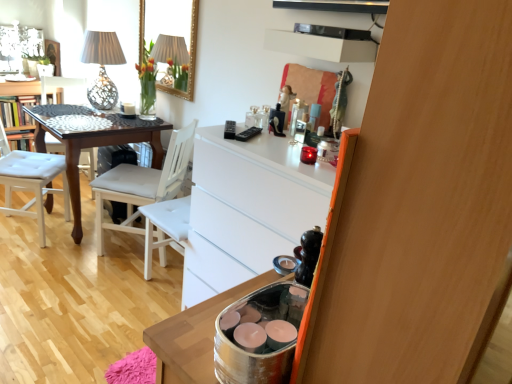
Find the location of a particular element. vacant space to the left of silver metallic container at lower right is located at coordinates (187, 337).